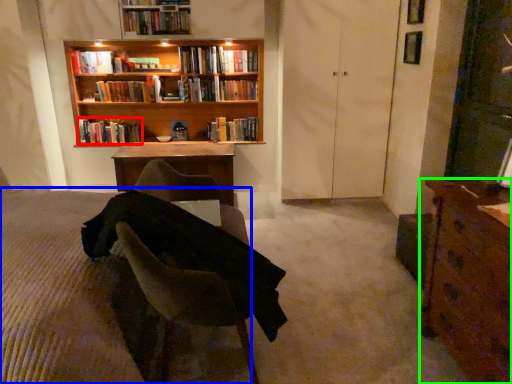
Question: Which object is positioned closest to book (highlighted by a red box)? Select from bed frame (highlighted by a blue box) and desk (highlighted by a green box).

Choices:
 (A) bed frame
 (B) desk

Answer: (A)